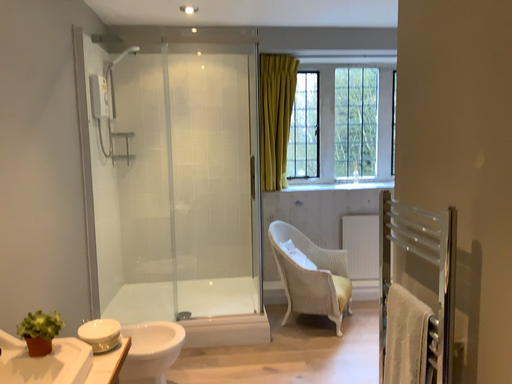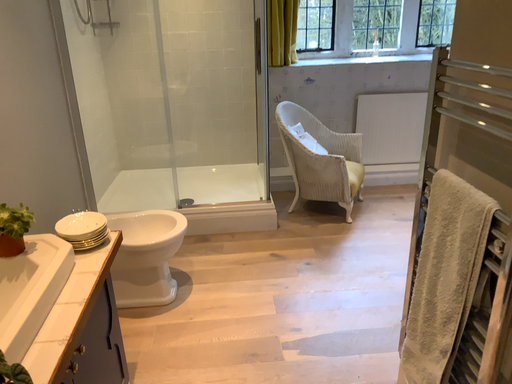
Question: How did the camera likely rotate when shooting the video?

Choices:
 (A) rotated downward
 (B) rotated upward

Answer: (A)